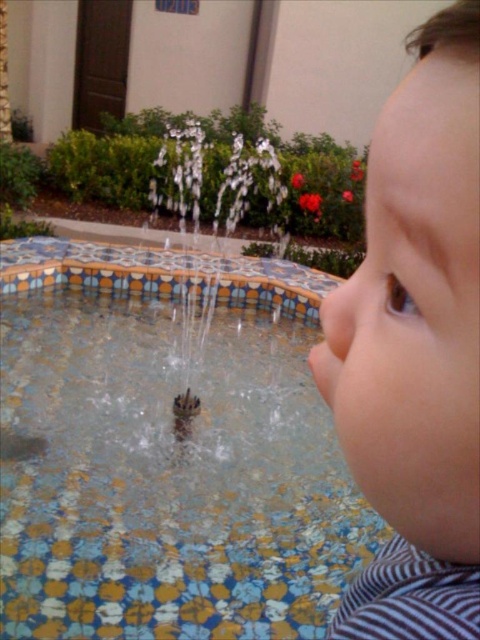
Question: Considering the relative positions of multicolored mosaic pool at center and smooth skin toddler at right in the image provided, where is multicolored mosaic pool at center located with respect to smooth skin toddler at right?

Choices:
 (A) left
 (B) right

Answer: (A)

Question: Which point is closer to the camera?

Choices:
 (A) smooth skin toddler at right
 (B) multicolored mosaic pool at center

Answer: (A)

Question: Is multicolored mosaic pool at center in front of smooth skin toddler at right?

Choices:
 (A) no
 (B) yes

Answer: (A)

Question: Can you confirm if multicolored mosaic pool at center is positioned to the left of smooth skin toddler at right?

Choices:
 (A) no
 (B) yes

Answer: (B)

Question: Which point is closer to the camera taking this photo?

Choices:
 (A) (416, 460)
 (B) (187, 273)

Answer: (A)

Question: Which point appears closest to the camera in this image?

Choices:
 (A) (322, 442)
 (B) (358, 412)

Answer: (B)